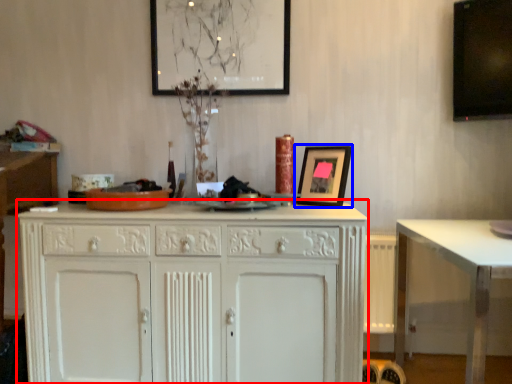
Question: Which object is further to the camera taking this photo, cabinetry (highlighted by a red box) or picture frame (highlighted by a blue box)?

Choices:
 (A) cabinetry
 (B) picture frame

Answer: (B)